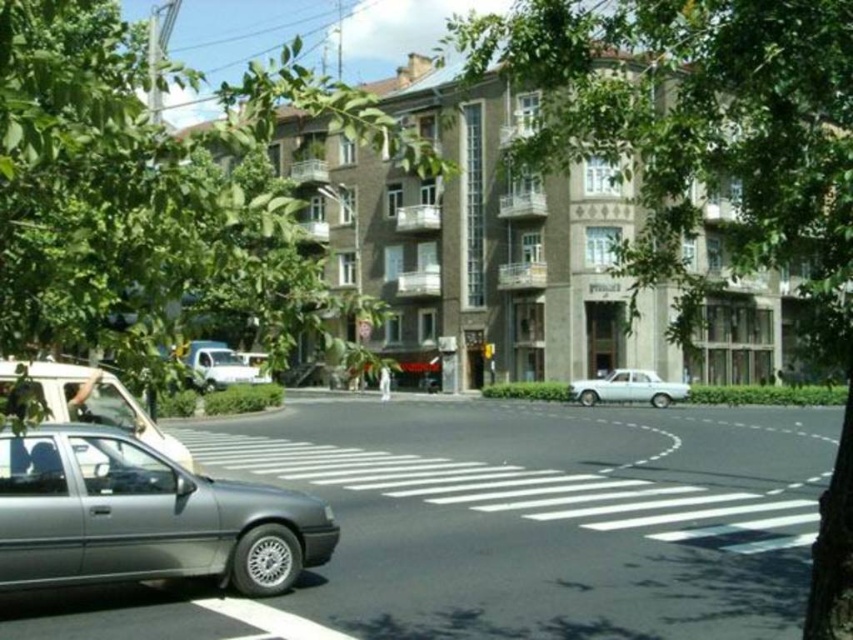
Question: Can you confirm if green leafy tree at upper left is smaller than white matte van at center?

Choices:
 (A) yes
 (B) no

Answer: (B)

Question: Does white glossy car at lower right have a greater width compared to white matte van at center?

Choices:
 (A) yes
 (B) no

Answer: (A)

Question: Which of these objects is positioned farthest from the green leafy tree at center?

Choices:
 (A) silver metallic car at left
 (B) metallic gray sedan at lower left
 (C) white glossy car at lower right

Answer: (A)

Question: Which point is closer to the camera?

Choices:
 (A) (195, 364)
 (B) (115, 557)
 (C) (573, 396)
 (D) (792, 257)

Answer: (D)

Question: Which of the following is the closest to the observer?

Choices:
 (A) green leafy tree at center
 (B) silver metallic car at left
 (C) white glossy car at lower right
 (D) green leafy tree at upper left

Answer: (D)

Question: Is white glossy car at lower right above white matte van at center?

Choices:
 (A) yes
 (B) no

Answer: (B)